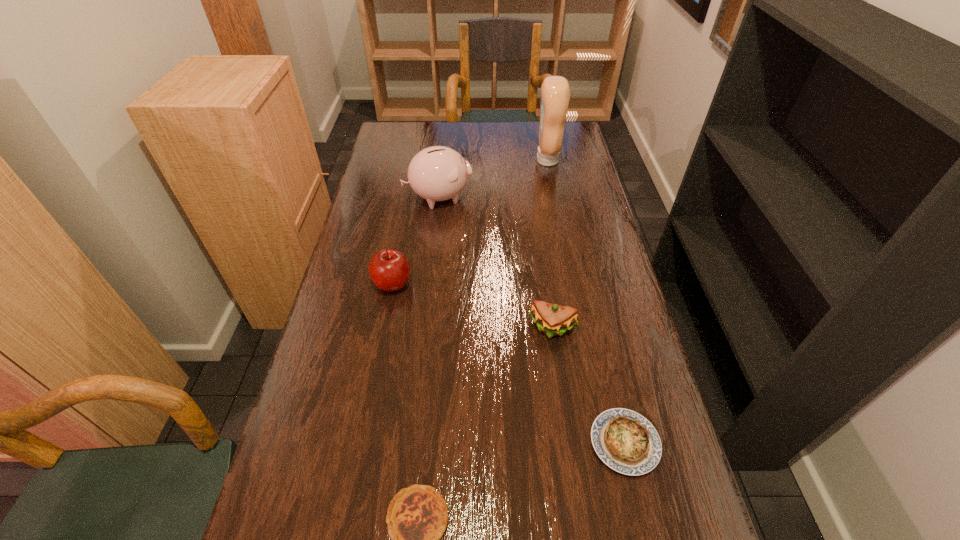
At what (x,y) coordinates should I click in order to perform the action: click on vacant region located 0.270m on the label of the farthest object. Please return your answer as a coordinate pair (x, y). Image resolution: width=960 pixels, height=540 pixels. Looking at the image, I should click on (461, 160).

Where is `vacant space located on the label of the farthest object`? The height and width of the screenshot is (540, 960). vacant space located on the label of the farthest object is located at coordinates (483, 160).

Where is `vacant space situated 0.190m on the label of the farthest object`? The width and height of the screenshot is (960, 540). vacant space situated 0.190m on the label of the farthest object is located at coordinates (483, 160).

Locate an element on the screen. The height and width of the screenshot is (540, 960). free spot located on the front of the second tallest object is located at coordinates (430, 273).

Identify the location of vacant region located on the right of the third tallest object. Image resolution: width=960 pixels, height=540 pixels. (435, 284).

This screenshot has height=540, width=960. Find the location of `free space located 0.080m on the back of the sandwich`. free space located 0.080m on the back of the sandwich is located at coordinates (547, 292).

Where is `vacant region located on the front of the farther quiche`? Image resolution: width=960 pixels, height=540 pixels. vacant region located on the front of the farther quiche is located at coordinates (639, 507).

Locate an element on the screen. The width and height of the screenshot is (960, 540). object situated at the far edge is located at coordinates (555, 92).

This screenshot has height=540, width=960. In order to click on piggy bank present at the left edge in this screenshot , I will do `click(438, 173)`.

The height and width of the screenshot is (540, 960). I want to click on apple present at the left edge, so click(389, 270).